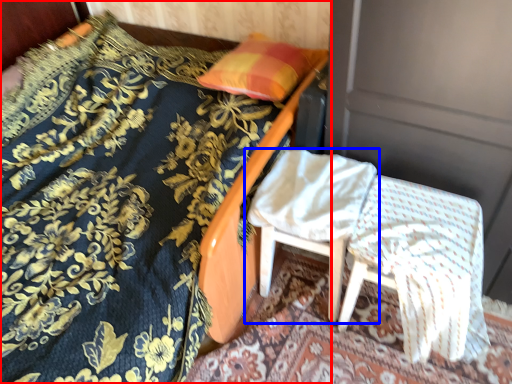
Question: Which of the following is the closest to the observer, bed (highlighted by a red box) or chair (highlighted by a blue box)?

Choices:
 (A) bed
 (B) chair

Answer: (A)